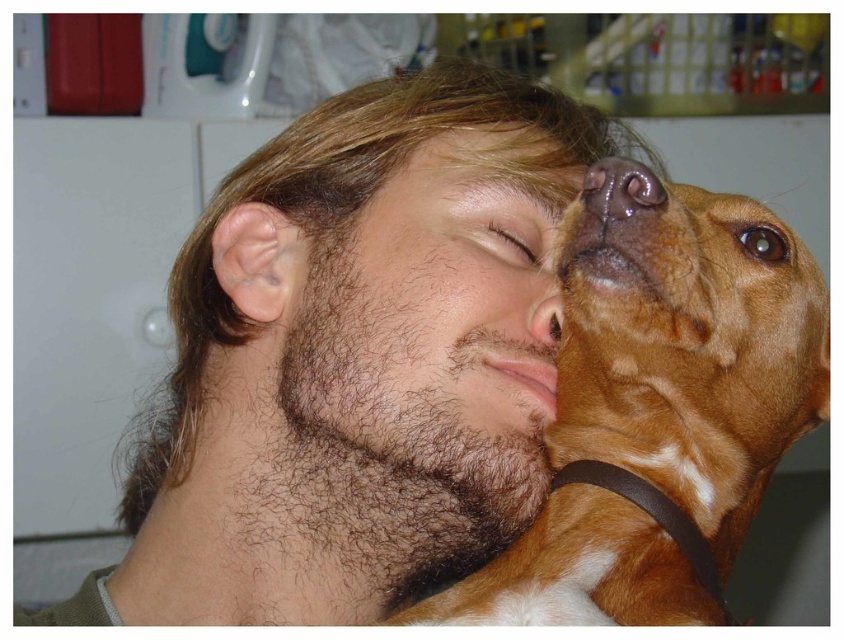
You are standing in the room and see two points in the image. The first point is at coordinate point (615, 172) and the second is at coordinate point (499, 248). Which point is closer to you?

Point (615, 172) is closer to the viewer than point (499, 248).

You are an interior designer assessing the layout of a room. You notice the brown leather dog at center and the brown matte eye at center. Based on their positions, which object would you say occupies more horizontal space in the image?

The brown leather dog at center might be wider than brown matte eye at center according to the description, so it likely occupies more horizontal space.

In the scene shown: You are an observer looking at the scene. Which object is positioned to the right side of the other between the shiny brown nose at center and the brown matte dog nose at upper center?

The shiny brown nose at center is positioned to the right of the brown matte dog nose at upper center.